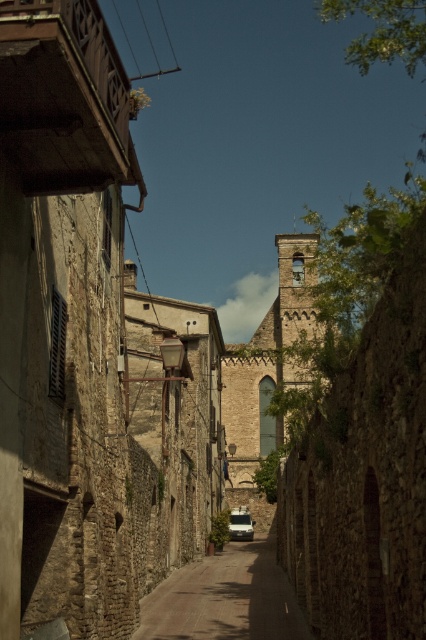
You are a delivery driver in the white matte van at center. You need to drive through the smooth stone alley at center to reach the church at the end. Can you safely navigate the van through the alley?

The smooth stone alley at center is above the white matte van at center, which means the alley is elevated or positioned higher than the van. This might indicate that the van cannot pass underneath due to height restrictions. Therefore, the van may not be able to safely navigate through the alley.

You are driving a white matte van at center and want to park it in the smooth stone alley at center. Can you fit the van into the alley if the alley is to the left of the van?

The smooth stone alley at center is to the left of the white matte van at center, so the van can be maneuvered into the alley since the alley is positioned to the left of the van.

Based on the scene description, where is the point located at coordinates (224, 598)?

The point at coordinates (224, 598) corresponds to the smooth stone alley at center.